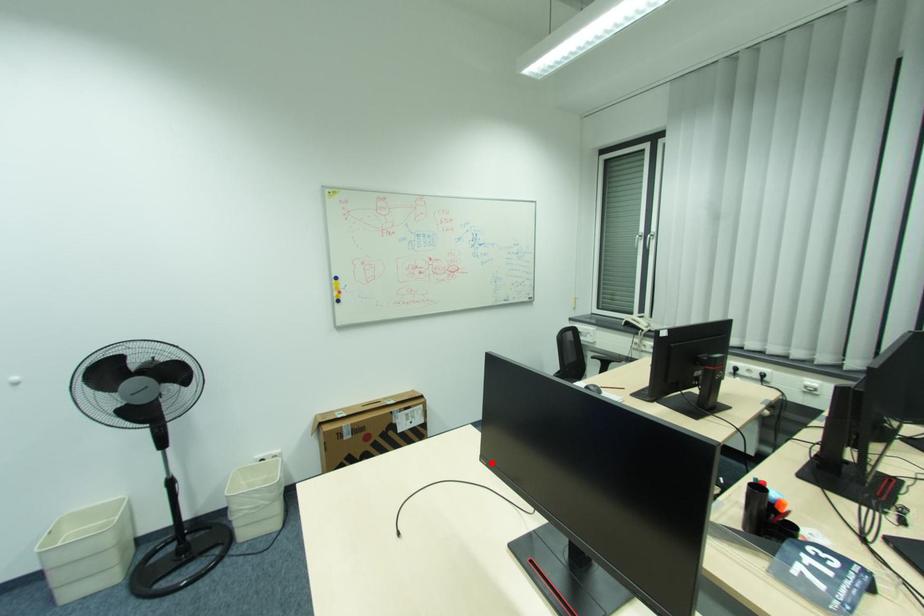
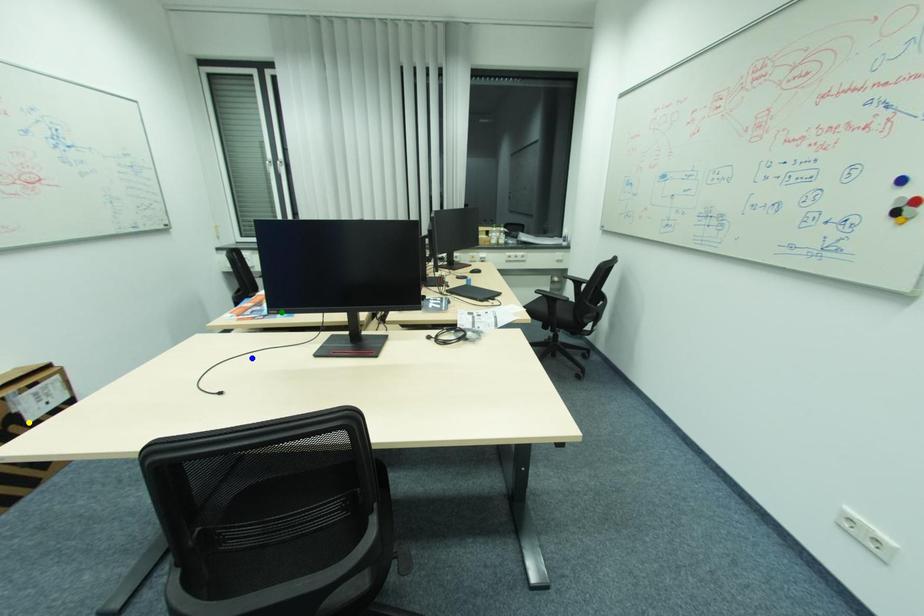
Question: I am providing you with two images of the same scene from different viewpoints. A red point is marked on the first image. You are given multiple points on the second image. Which point in image 2 represents the same 3d spot as the red point in image 1?

Choices:
 (A) blue point
 (B) yellow point
 (C) green point

Answer: (C)